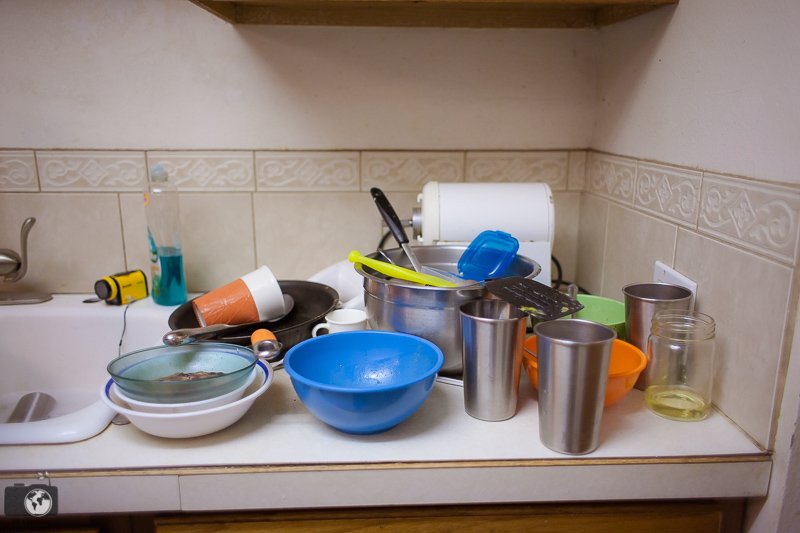
I want to click on cupboard, so click(502, 518).